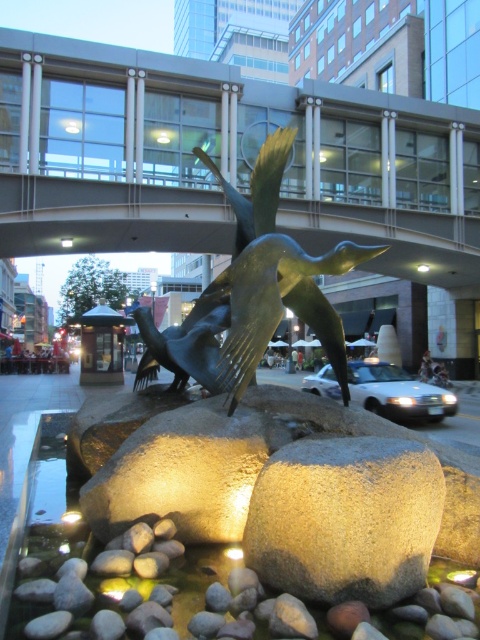
Question: Which point is farther to the camera?

Choices:
 (A) bronze sculpture at center
 (B) smooth gray rock at center

Answer: (A)

Question: Is smooth gray rock at center wider than bronze sculpture at center?

Choices:
 (A) yes
 (B) no

Answer: (A)

Question: Can you confirm if smooth gray rock at center is wider than bronze sculpture at center?

Choices:
 (A) yes
 (B) no

Answer: (A)

Question: Observing the image, what is the correct spatial positioning of smooth gray rock at center in reference to bronze sculpture at center?

Choices:
 (A) above
 (B) below

Answer: (B)

Question: Which point is closer to the camera taking this photo?

Choices:
 (A) (262, 189)
 (B) (320, 468)

Answer: (B)